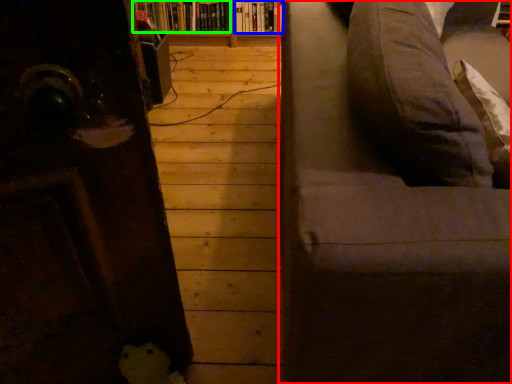
Question: Which object is the farthest from studio couch (highlighted by a red box)? Choose among these: book (highlighted by a blue box) or book (highlighted by a green box).

Choices:
 (A) book
 (B) book

Answer: (A)